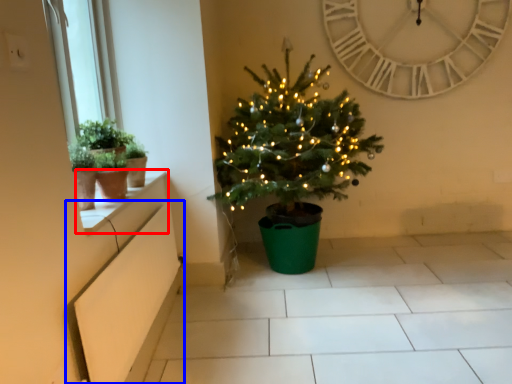
Question: Among these objects, which one is farthest to the camera, window sill (highlighted by a red box) or window box (highlighted by a blue box)?

Choices:
 (A) window sill
 (B) window box

Answer: (A)